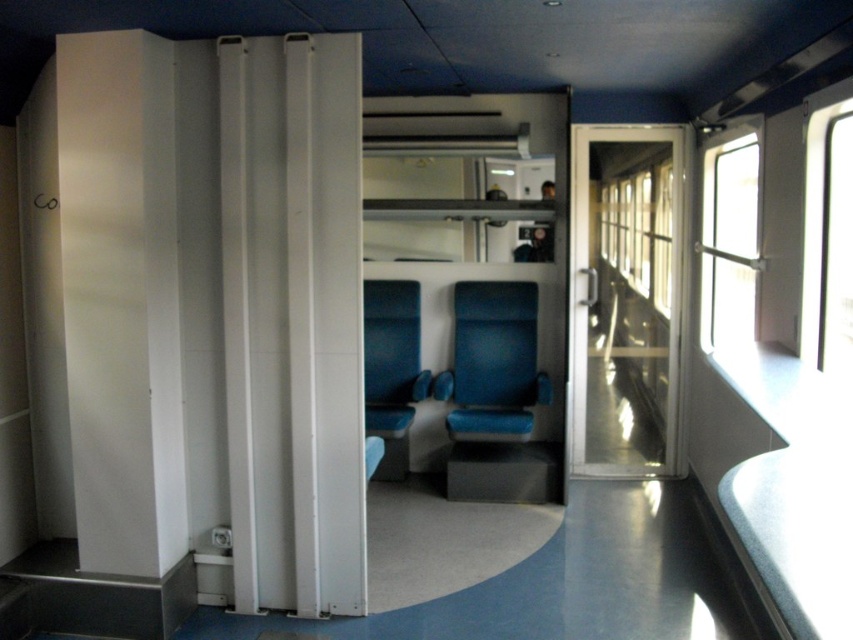
Which is below, blue fabric chair at center or metallic silver coach at center?

blue fabric chair at center is lower down.

Between point (381, 396) and point (549, 259), which one is positioned in front?

Point (549, 259)

Between point (387, 412) and point (552, 253), which one is positioned in front?

Point (387, 412) is more forward.

The height and width of the screenshot is (640, 853). What are the coordinates of `blue fabric chair at center` in the screenshot? It's located at (392, 372).

Is matte blue seat at center thinner than metallic silver coach at center?

In fact, matte blue seat at center might be wider than metallic silver coach at center.

In the scene shown: Is matte blue seat at center smaller than metallic silver coach at center?

Actually, matte blue seat at center might be larger than metallic silver coach at center.

I want to click on matte blue seat at center, so click(496, 397).

Between matte blue seat at center and blue fabric chair at center, which one has more height?

With more height is matte blue seat at center.

Which is in front, point (468, 452) or point (393, 468)?

Positioned in front is point (468, 452).

Identify the location of matte blue seat at center. (496, 397).